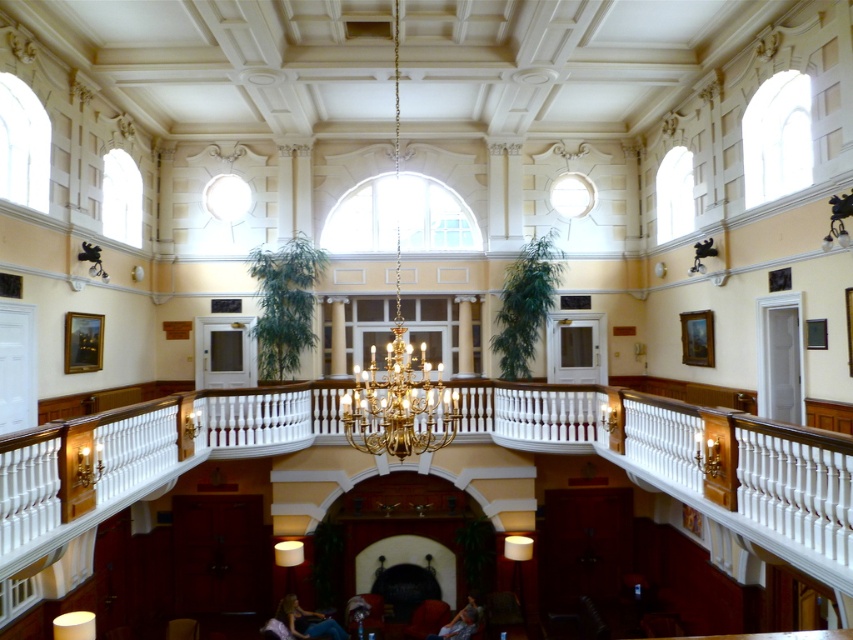
Does gold metallic chandelier at center come in front of light brown leather jacket at lower center?

Yes, gold metallic chandelier at center is closer to the viewer.

At what (x,y) coordinates should I click in order to perform the action: click on gold metallic chandelier at center. Please return your answer as a coordinate pair (x, y). The image size is (853, 640). Looking at the image, I should click on (398, 371).

Which is more to the right, gold metallic chandelier at center or blue fabric person at lower center?

Positioned to the right is gold metallic chandelier at center.

Describe the element at coordinates (398, 371) in the screenshot. I see `gold metallic chandelier at center` at that location.

Where is `gold metallic chandelier at center`? gold metallic chandelier at center is located at coordinates (398, 371).

Who is lower down, blue fabric person at lower center or light brown leather jacket at lower center?

blue fabric person at lower center

How distant is blue fabric person at lower center from light brown leather jacket at lower center?

blue fabric person at lower center and light brown leather jacket at lower center are 6.14 feet apart.

You are a GUI agent. You are given a task and a screenshot of the screen. Output one action in this format:
    pyautogui.click(x=<x>, y=<y>)
    Task: Click on the blue fabric person at lower center
    
    Given the screenshot: What is the action you would take?
    pyautogui.click(x=306, y=620)